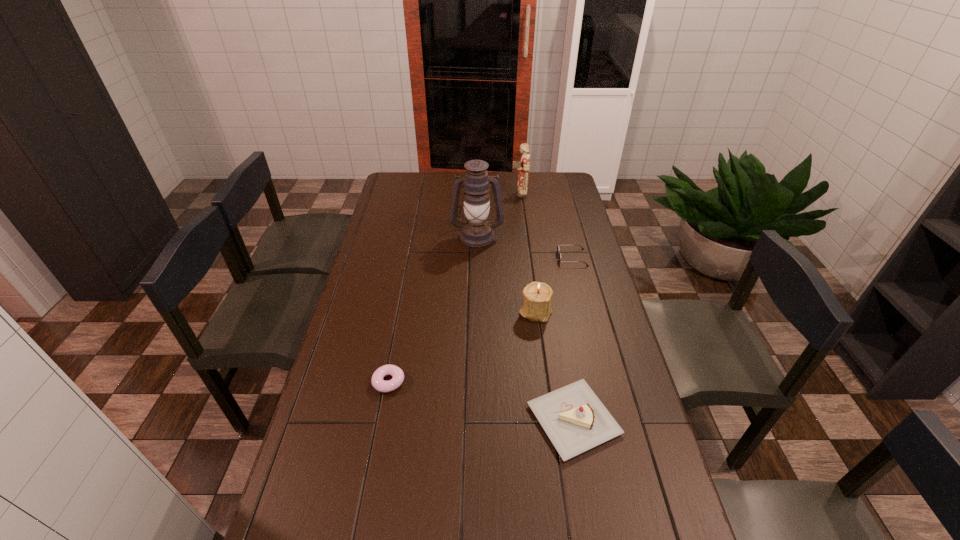
Where is `object at the left edge`? object at the left edge is located at coordinates (378, 383).

I want to click on cake that is at the right edge, so click(x=575, y=420).

Identify the location of sunglasses that is at the right edge. (558, 249).

This screenshot has width=960, height=540. In the image, there is a desktop. In order to click on vacant space at the far edge in this screenshot , I will do `click(489, 176)`.

At what (x,y) coordinates should I click in order to perform the action: click on free region at the left edge of the desktop. Please return your answer as a coordinate pair (x, y). This screenshot has width=960, height=540. Looking at the image, I should click on pyautogui.click(x=403, y=204).

Locate an element on the screen. The height and width of the screenshot is (540, 960). vacant area at the right edge is located at coordinates (560, 235).

The image size is (960, 540). Identify the location of free space at the far left corner of the desktop. (414, 191).

Find the location of a particular element. The width and height of the screenshot is (960, 540). free space between the doughnut and the second tallest object is located at coordinates (454, 288).

The image size is (960, 540). I want to click on empty space between the cake and the fourth nearest object, so click(x=573, y=339).

Find the location of `free space between the figurine and the fourth farthest object`. free space between the figurine and the fourth farthest object is located at coordinates (x=527, y=252).